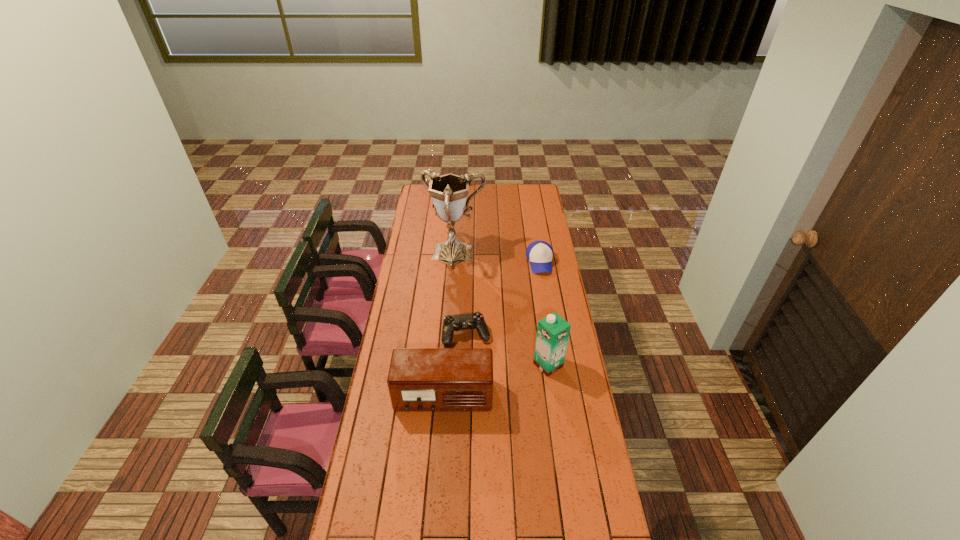
You are a GUI agent. You are given a task and a screenshot of the screen. Output one action in this format:
    pyautogui.click(x=<x>, y=<y>)
    Task: Click on the free space located on the front-facing side of the baseball cap
    
    Given the screenshot: What is the action you would take?
    pyautogui.click(x=546, y=301)

This screenshot has height=540, width=960. I want to click on vacant space located 0.210m on the front of the control, so click(x=465, y=389).

The height and width of the screenshot is (540, 960). What are the coordinates of `trophy cup present at the left edge` in the screenshot? It's located at (448, 192).

Where is `radio receiver located in the left edge section of the desktop`? radio receiver located in the left edge section of the desktop is located at coordinates (420, 379).

In order to click on carton that is at the right edge in this screenshot , I will do `click(553, 331)`.

The height and width of the screenshot is (540, 960). I want to click on baseball cap that is at the right edge, so click(539, 253).

Image resolution: width=960 pixels, height=540 pixels. In order to click on vacant space at the far edge of the desktop in this screenshot , I will do `click(513, 187)`.

The width and height of the screenshot is (960, 540). In order to click on vacant region at the left edge of the desktop in this screenshot , I will do `click(397, 326)`.

In the image, there is a desktop. What are the coordinates of `free space at the right edge` in the screenshot? It's located at (535, 292).

The image size is (960, 540). In order to click on free space at the far left corner of the desktop in this screenshot , I will do point(417,202).